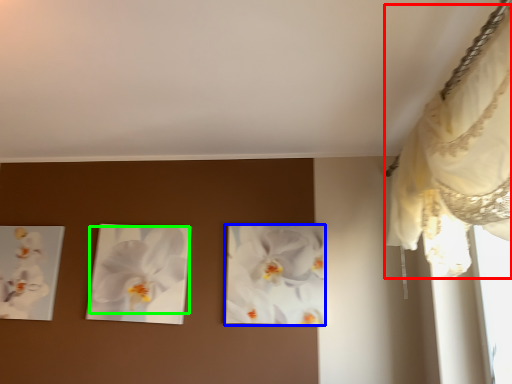
Question: Which object is positioned farthest from curtain (highlighted by a red box)? Select from flower (highlighted by a blue box) and flower (highlighted by a green box).

Choices:
 (A) flower
 (B) flower

Answer: (B)